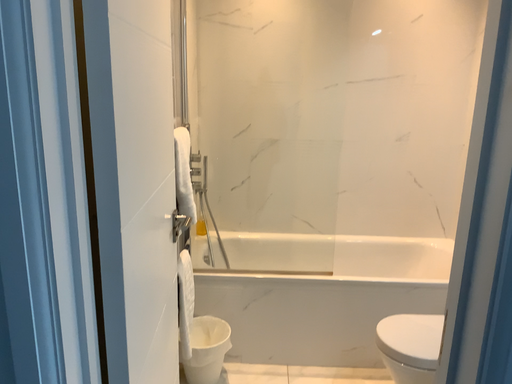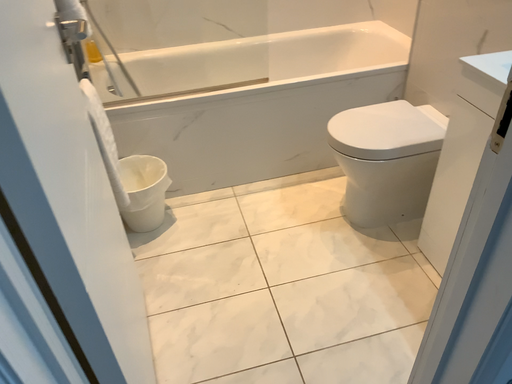
Question: Which way did the camera rotate in the video?

Choices:
 (A) rotated upward
 (B) rotated downward

Answer: (B)